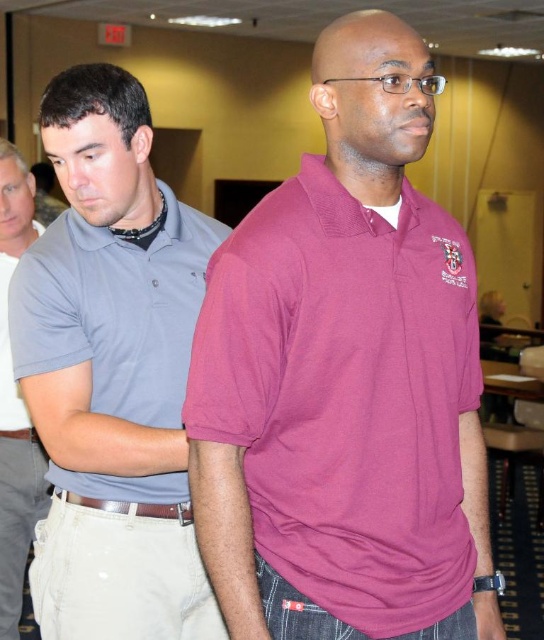
Is burgundy pique polo shirt at center wider than matte gray polo shirt at left?

Yes.

Between burgundy pique polo shirt at center and matte gray polo shirt at left, which one is positioned lower?

matte gray polo shirt at left

Find the location of a particular element. Image resolution: width=544 pixels, height=640 pixels. burgundy pique polo shirt at center is located at coordinates (345, 380).

Where is `burgundy pique polo shirt at center`? burgundy pique polo shirt at center is located at coordinates (345, 380).

Looking at this image, is burgundy pique polo shirt at center bigger than matte gray polo at center?

Yes.

Measure the distance from burgundy pique polo shirt at center to matte gray polo at center.

A distance of 1.19 meters exists between burgundy pique polo shirt at center and matte gray polo at center.

In the scene shown: Who is more forward, (220,259) or (0,364)?

Point (220,259)

Find the location of a particular element. This screenshot has height=640, width=544. burgundy pique polo shirt at center is located at coordinates (345, 380).

What do you see at coordinates (345, 380) in the screenshot? I see `burgundy pique polo shirt at center` at bounding box center [345, 380].

From the picture: Is burgundy pique polo shirt at center above matte gray shirt at left?

Yes, burgundy pique polo shirt at center is above matte gray shirt at left.

Does point (423, 301) come farther from viewer compared to point (15, 401)?

No, (423, 301) is closer to viewer.

Identify the location of burgundy pique polo shirt at center. This screenshot has width=544, height=640. (345, 380).